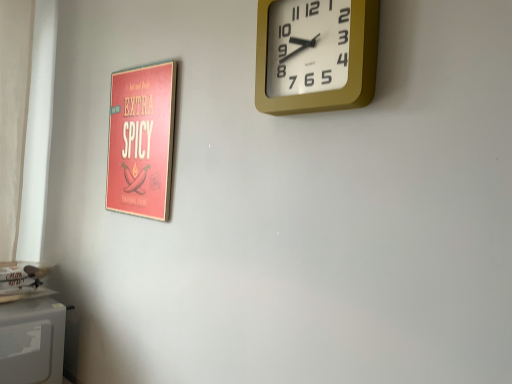
Image resolution: width=512 pixels, height=384 pixels. What are the coordinates of `white matte microwave at lower left` in the screenshot? It's located at (32, 341).

What do you see at coordinates (142, 140) in the screenshot? The image size is (512, 384). I see `matte red poster at left` at bounding box center [142, 140].

At what (x,y) coordinates should I click in order to perform the action: click on white matte microwave at lower left. Please return your answer as a coordinate pair (x, y). Looking at the image, I should click on pos(32,341).

From the image's perspective, who appears lower, white matte microwave at lower left or matte red poster at left?

white matte microwave at lower left, from the image's perspective.

Between white matte microwave at lower left and matte red poster at left, which one has less height?

Standing shorter between the two is white matte microwave at lower left.

Considering the positions of point (29, 338) and point (114, 203), is point (29, 338) closer or farther from the camera than point (114, 203)?

Point (29, 338).

At what (x,y) coordinates should I click in order to perform the action: click on poster page that appears in front of the white matte microwave at lower left. Please return your answer as a coordinate pair (x, y). The image size is (512, 384). Looking at the image, I should click on pos(142,140).

From the image's perspective, which is below, matte red poster at left or white matte microwave at lower left?

white matte microwave at lower left appears lower in the image.

Does matte red poster at left turn towards white matte microwave at lower left?

No, matte red poster at left is not facing towards white matte microwave at lower left.

Locate an element on the screen. The width and height of the screenshot is (512, 384). poster page in front of the white matte microwave at lower left is located at coordinates (142, 140).

Is there a large distance between white matte microwave at lower left and gold metallic wall clock at upper right?

Yes.

From a real-world perspective, which is physically below, white matte microwave at lower left or gold metallic wall clock at upper right?

From a 3D spatial view, white matte microwave at lower left is below.

Is white matte microwave at lower left positioned with its back to gold metallic wall clock at upper right?

No, white matte microwave at lower left's orientation is not away from gold metallic wall clock at upper right.

From the image's perspective, which is below, gold metallic wall clock at upper right or white matte microwave at lower left?

white matte microwave at lower left is shown below in the image.

Between gold metallic wall clock at upper right and white matte microwave at lower left, which one has larger width?

white matte microwave at lower left.

Which is closer, [274,4] or [47,358]?

Point [274,4] is closer to the camera than point [47,358].

Considering the relative positions of gold metallic wall clock at upper right and white matte microwave at lower left in the image provided, is gold metallic wall clock at upper right to the left or to the right of white matte microwave at lower left?

gold metallic wall clock at upper right is positioned on white matte microwave at lower left's right side.

Does point (110, 143) come behind point (281, 1)?

Yes, it is.

Considering the positions of objects matte red poster at left and gold metallic wall clock at upper right in the image provided, who is more to the left, matte red poster at left or gold metallic wall clock at upper right?

matte red poster at left is more to the left.

From a real-world perspective, does matte red poster at left stand above gold metallic wall clock at upper right?

Incorrect, from a real-world perspective, matte red poster at left is lower than gold metallic wall clock at upper right.

Consider the image. Is matte red poster at left completely or partially outside of gold metallic wall clock at upper right?

→ Yes, matte red poster at left is located beyond the bounds of gold metallic wall clock at upper right.

In terms of height, does gold metallic wall clock at upper right look taller or shorter compared to matte red poster at left?

gold metallic wall clock at upper right is shorter than matte red poster at left.

Would you say gold metallic wall clock at upper right is outside matte red poster at left?

Yes, gold metallic wall clock at upper right is outside of matte red poster at left.

Is gold metallic wall clock at upper right thinner than matte red poster at left?

Incorrect, the width of gold metallic wall clock at upper right is not less than that of matte red poster at left.

Is gold metallic wall clock at upper right facing away from matte red poster at left?

No, gold metallic wall clock at upper right is not facing the opposite direction of matte red poster at left.

Image resolution: width=512 pixels, height=384 pixels. Find the location of `poster page that appears in front of the white matte microwave at lower left`. poster page that appears in front of the white matte microwave at lower left is located at coordinates (142, 140).

I want to click on poster page on the right of white matte microwave at lower left, so click(142, 140).

Considering their positions, is matte red poster at left positioned closer to white matte microwave at lower left than gold metallic wall clock at upper right?

Based on the image, matte red poster at left appears to be nearer to white matte microwave at lower left.

Based on their spatial positions, is white matte microwave at lower left or matte red poster at left further from gold metallic wall clock at upper right?

white matte microwave at lower left is positioned further to the anchor gold metallic wall clock at upper right.

Looking at the image, which one is located further to white matte microwave at lower left, gold metallic wall clock at upper right or matte red poster at left?

Among the two, gold metallic wall clock at upper right is located further to white matte microwave at lower left.

From the image, which object appears to be nearer to gold metallic wall clock at upper right, matte red poster at left or white matte microwave at lower left?

The object closer to gold metallic wall clock at upper right is matte red poster at left.

Looking at the image, which one is located further to matte red poster at left, white matte microwave at lower left or gold metallic wall clock at upper right?

white matte microwave at lower left is positioned further to the anchor matte red poster at left.

Estimate the real-world distances between objects in this image. Which object is further from matte red poster at left, gold metallic wall clock at upper right or white matte microwave at lower left?

white matte microwave at lower left lies further to matte red poster at left than the other object.

Image resolution: width=512 pixels, height=384 pixels. Identify the location of poster page situated between white matte microwave at lower left and gold metallic wall clock at upper right from left to right. (142, 140).